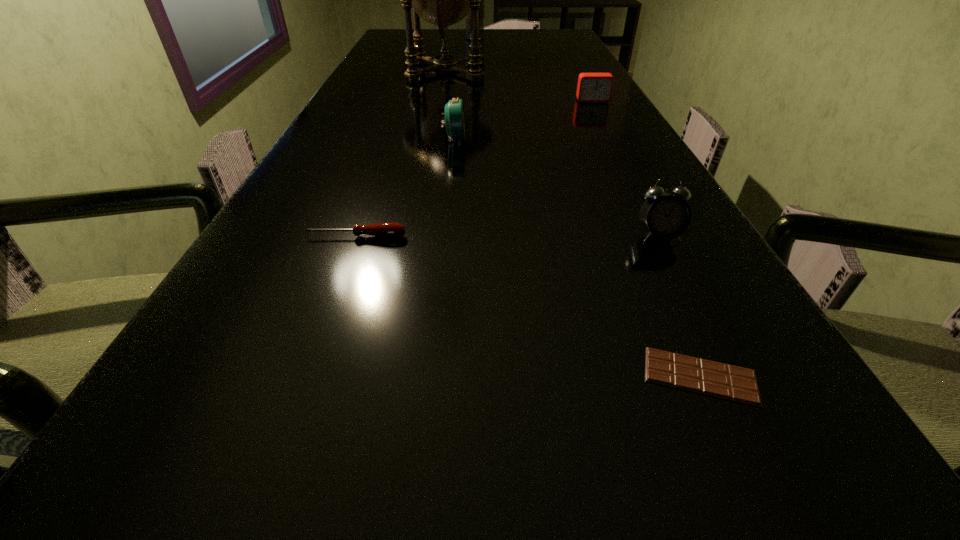
This screenshot has height=540, width=960. Identify the location of globe present at the left edge. (442, 0).

At what (x,y) coordinates should I click in order to perform the action: click on screwdriver that is at the left edge. Please return your answer as a coordinate pair (x, y). This screenshot has width=960, height=540. Looking at the image, I should click on (389, 229).

I want to click on chocolate bar that is at the right edge, so click(715, 379).

I want to click on vacant space at the far edge of the desktop, so click(528, 36).

Identify the location of blank space at the left edge of the desktop. The image size is (960, 540). (303, 281).

Locate an element on the screen. Image resolution: width=960 pixels, height=540 pixels. blank space at the right edge of the desktop is located at coordinates (572, 100).

This screenshot has width=960, height=540. What are the coordinates of `free location at the far left corner` in the screenshot? It's located at (386, 38).

Where is `blank space at the near left corner of the desktop`? Image resolution: width=960 pixels, height=540 pixels. blank space at the near left corner of the desktop is located at coordinates tap(247, 524).

Identify the location of free spot between the second tallest object and the tallest object. The image size is (960, 540). (460, 54).

Identify the location of vacant space in between the second farthest alarm clock and the shortest object. (577, 258).